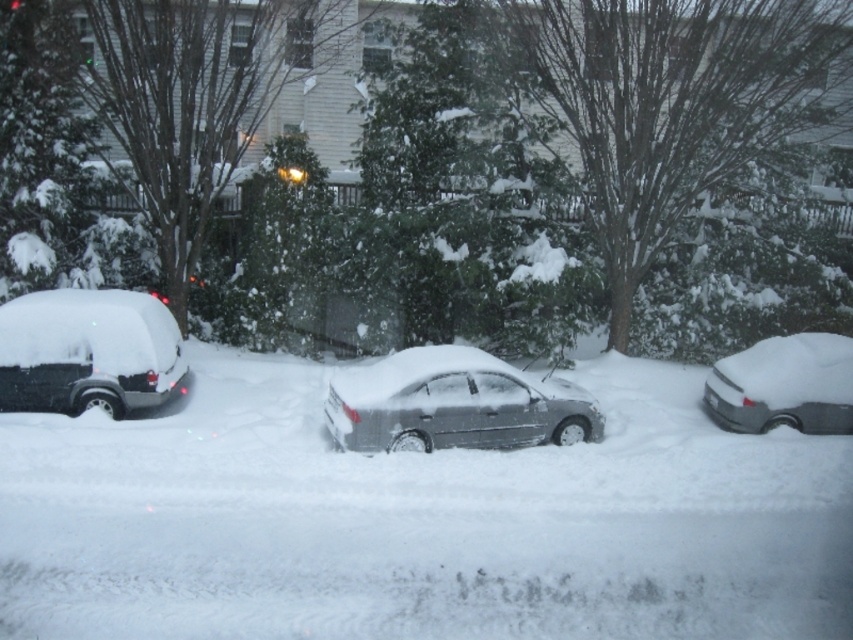
Looking at this image, who is taller, sleek silver sedan at center or matte black van at left?

matte black van at left is taller.

Measure the distance between sleek silver sedan at center and matte black van at left.

sleek silver sedan at center is 3.76 meters from matte black van at left.

Image resolution: width=853 pixels, height=640 pixels. Describe the element at coordinates (454, 403) in the screenshot. I see `sleek silver sedan at center` at that location.

Find the location of a particular element. Image resolution: width=853 pixels, height=640 pixels. sleek silver sedan at center is located at coordinates (454, 403).

Is matte black van at left in front of silver metallic sedan at right?

Yes, matte black van at left is closer to the viewer.

Find the location of a particular element. The height and width of the screenshot is (640, 853). matte black van at left is located at coordinates (86, 352).

Between white fluffy snow at center and silver metallic sedan at right, which one appears on the left side from the viewer's perspective?

white fluffy snow at center

The width and height of the screenshot is (853, 640). I want to click on white fluffy snow at center, so click(x=416, y=520).